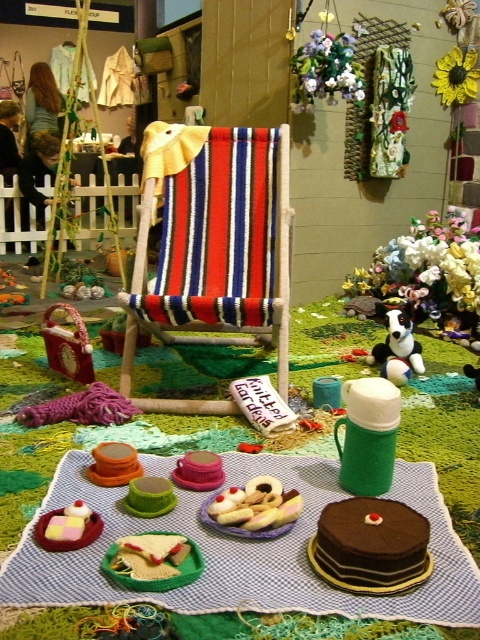
Question: From the image, what is the correct spatial relationship of smooth white cream puff at center in relation to black plush dog at center?

Choices:
 (A) left
 (B) right

Answer: (A)

Question: Which point is farther to the camera?

Choices:
 (A) pos(315,496)
 (B) pos(420,364)
 (C) pos(237,502)
 (D) pos(271,164)

Answer: (B)

Question: Among these objects, which one is nearest to the camera?

Choices:
 (A) knitted fabric chair at center
 (B) smooth white cream puff at center
 (C) velvety green tablecloth at center

Answer: (C)

Question: Which of the following is the farthest from the observer?

Choices:
 (A) (277, 262)
 (B) (414, 368)

Answer: (B)

Question: Is the position of knitted fabric chair at center less distant than that of smooth white cream puff at center?

Choices:
 (A) yes
 (B) no

Answer: (B)

Question: Does velvety green tablecloth at center have a larger size compared to smooth white cream puff at center?

Choices:
 (A) yes
 (B) no

Answer: (A)